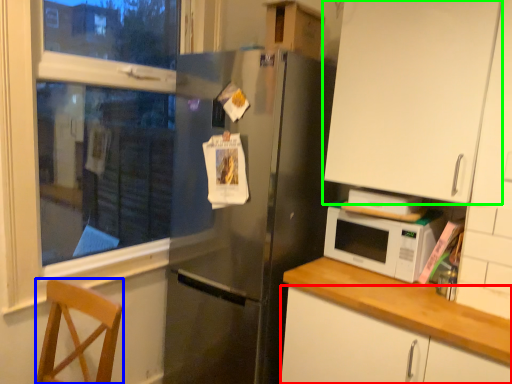
Question: Which object is the closest to the cabinetry (highlighted by a red box)? Choose among these: chair (highlighted by a blue box) or cabinetry (highlighted by a green box).

Choices:
 (A) chair
 (B) cabinetry

Answer: (B)